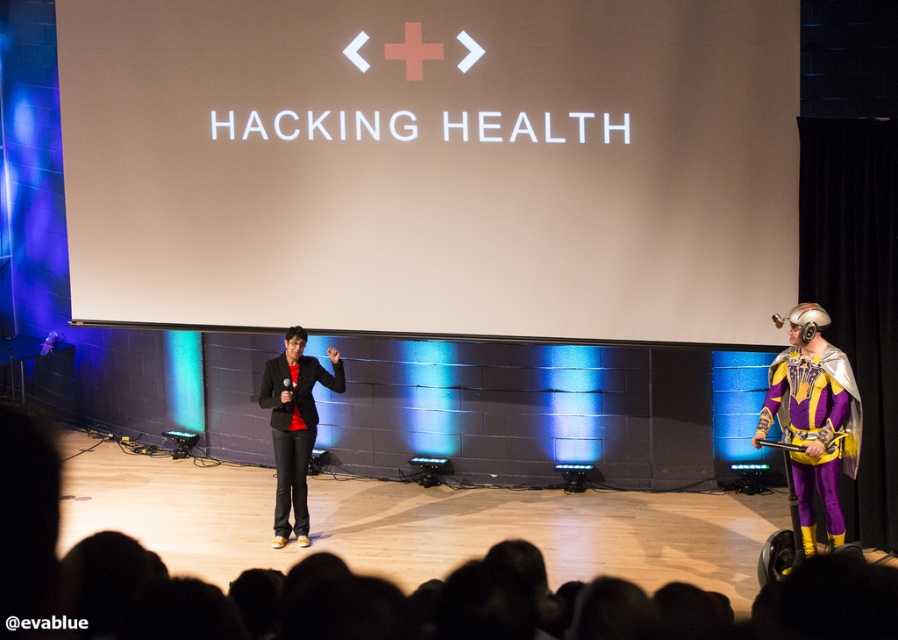
Question: Where is purple shiny costume at right located in relation to black matte suit at center in the image?

Choices:
 (A) right
 (B) left

Answer: (A)

Question: Among these objects, which one is nearest to the camera?

Choices:
 (A) purple shiny costume at right
 (B) black matte suit at center

Answer: (A)

Question: Is purple shiny costume at right below black matte suit at center?

Choices:
 (A) no
 (B) yes

Answer: (A)

Question: Which point is closer to the camera?

Choices:
 (A) black matte suit at center
 (B) purple shiny costume at right

Answer: (B)

Question: Which point appears farthest from the camera in this image?

Choices:
 (A) [288, 500]
 (B) [817, 339]

Answer: (A)

Question: Does purple shiny costume at right appear over black matte suit at center?

Choices:
 (A) no
 (B) yes

Answer: (B)